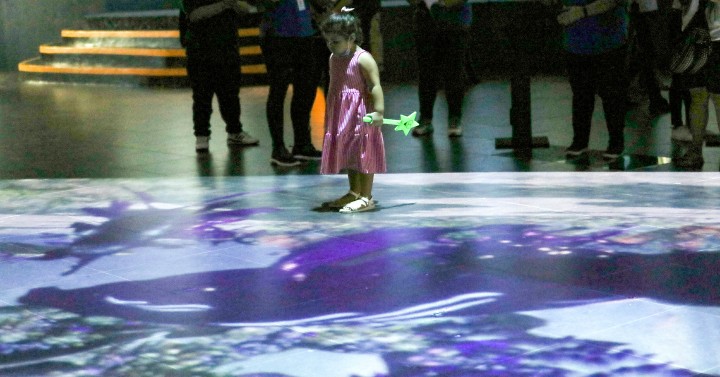
Where is `light reflection on the floor`? This screenshot has width=720, height=377. light reflection on the floor is located at coordinates (618, 326), (336, 365), (184, 258), (507, 206), (562, 177).